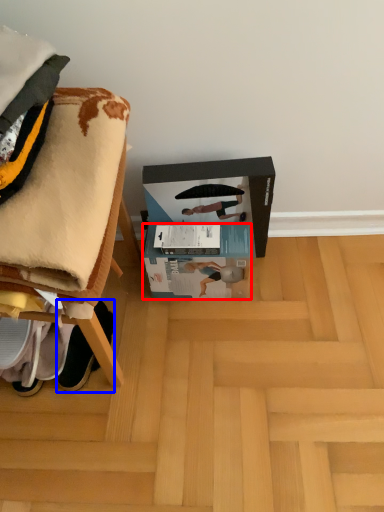
Question: Among these objects, which one is nearest to the camera, box (highlighted by a red box) or footwear (highlighted by a blue box)?

Choices:
 (A) box
 (B) footwear

Answer: (B)